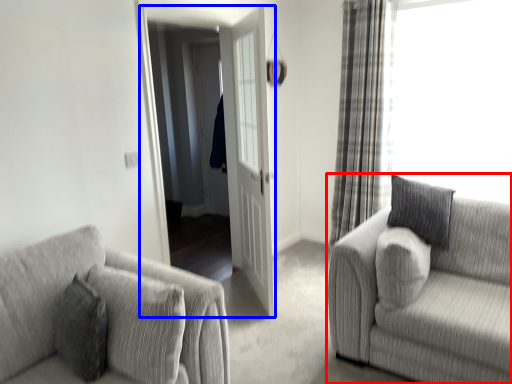
Question: Which point is closer to the camera, studio couch (highlighted by a red box) or screen door (highlighted by a blue box)?

Choices:
 (A) studio couch
 (B) screen door

Answer: (A)